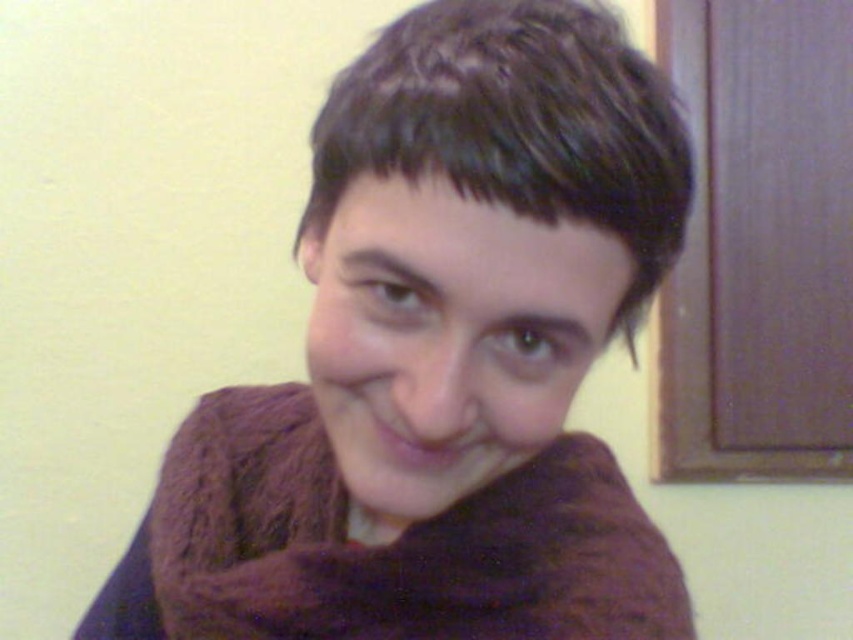
Is purple knitted scarf at center above brown fuzzy scarf at center?

Indeed, purple knitted scarf at center is positioned over brown fuzzy scarf at center.

Locate an element on the screen. Image resolution: width=853 pixels, height=640 pixels. purple knitted scarf at center is located at coordinates (439, 358).

What are the coordinates of `purple knitted scarf at center` in the screenshot? It's located at (439, 358).